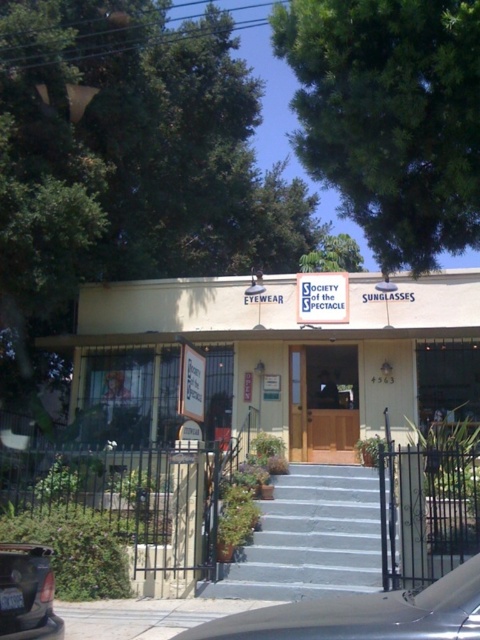
Based on the photo, can you confirm if silver metallic car at center is positioned above wooden door at center?

Correct, silver metallic car at center is located above wooden door at center.

Is silver metallic car at center further to the viewer compared to wooden door at center?

No, it is not.

Which is in front, point (232, 632) or point (324, 449)?

Point (232, 632) is in front.

Identify the location of silver metallic car at center. The width and height of the screenshot is (480, 640). (x=363, y=614).

Does gray concrete stairs at center have a smaller size compared to wooden door at center?

Actually, gray concrete stairs at center might be larger than wooden door at center.

Which of these two, gray concrete stairs at center or wooden door at center, stands shorter?

gray concrete stairs at center

What do you see at coordinates (310, 538) in the screenshot? This screenshot has height=640, width=480. I see `gray concrete stairs at center` at bounding box center [310, 538].

You are a GUI agent. You are given a task and a screenshot of the screen. Output one action in this format:
    pyautogui.click(x=<x>, y=<y>)
    Task: Click on the gray concrete stairs at center
    The width and height of the screenshot is (480, 640).
    Given the screenshot: What is the action you would take?
    pyautogui.click(x=310, y=538)

Does beige wooden door at center appear on the left side of matte black car at lower left?

Incorrect, beige wooden door at center is not on the left side of matte black car at lower left.

Between beige wooden door at center and matte black car at lower left, which one is positioned lower?

Positioned lower is beige wooden door at center.

You are a GUI agent. You are given a task and a screenshot of the screen. Output one action in this format:
    pyautogui.click(x=<x>, y=<y>)
    Task: Click on the beige wooden door at center
    The width and height of the screenshot is (480, 640).
    Given the screenshot: What is the action you would take?
    277,358